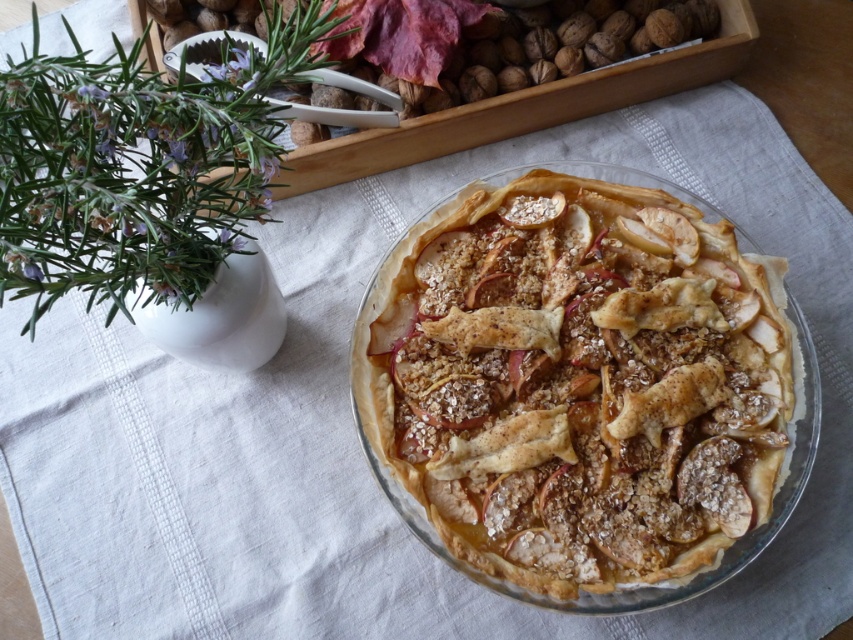
Question: Which point is farther from the camera taking this photo?

Choices:
 (A) (438, 380)
 (B) (579, 45)

Answer: (B)

Question: Can you confirm if golden flaky pie at center is bigger than brown textured nuts at upper center?

Choices:
 (A) no
 (B) yes

Answer: (A)

Question: Does golden flaky pie at center appear over brown textured nuts at upper center?

Choices:
 (A) yes
 (B) no

Answer: (B)

Question: Which point is closer to the camera taking this photo?

Choices:
 (A) (490, 552)
 (B) (277, 100)

Answer: (A)

Question: Is golden flaky pie at center to the right of brown textured nuts at upper center from the viewer's perspective?

Choices:
 (A) no
 (B) yes

Answer: (B)

Question: Which of the following is the closest to the observer?

Choices:
 (A) golden flaky pie at center
 (B) brown textured nuts at upper center

Answer: (B)